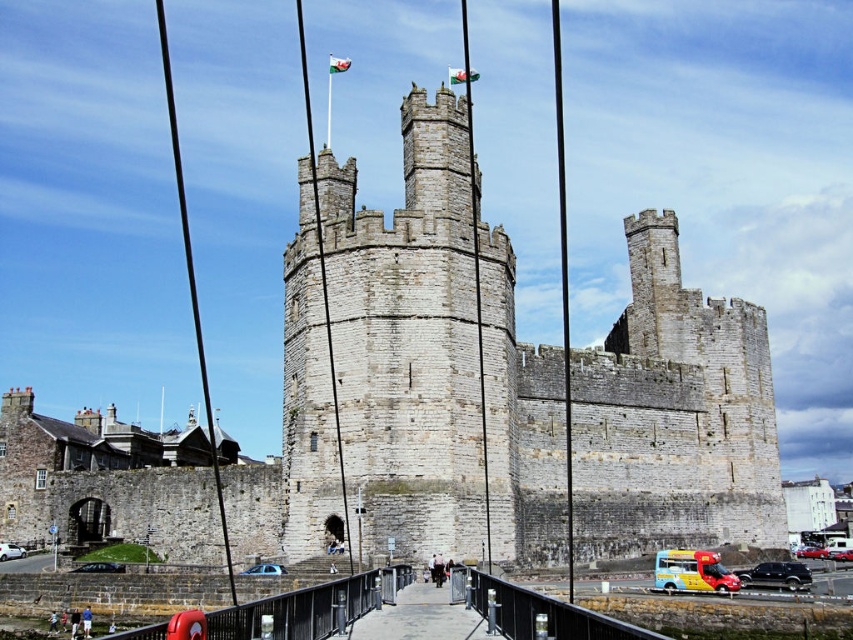
Is the position of gray stone castle at center less distant than that of metallic gray bridge at center?

No, gray stone castle at center is behind metallic gray bridge at center.

Identify the location of gray stone castle at center. (378, 364).

Is point (369, 470) more distant than point (521, 614)?

Yes.

Identify the location of gray stone castle at center. (378, 364).

Can you confirm if metallic gray bridge at center is bigger than concrete walkway at center?

Yes.

How distant is metallic gray bridge at center from concrete walkway at center?

metallic gray bridge at center and concrete walkway at center are 2.46 meters apart from each other.

Between point (483, 612) and point (408, 596), which one is positioned behind?

The point (408, 596) is more distant.

Where is `metallic gray bridge at center`? metallic gray bridge at center is located at coordinates (303, 609).

Does gray stone castle at center appear on the right side of concrete walkway at center?

No, gray stone castle at center is not to the right of concrete walkway at center.

You are a GUI agent. You are given a task and a screenshot of the screen. Output one action in this format:
    pyautogui.click(x=<x>, y=<y>)
    Task: Click on the gray stone castle at center
    This screenshot has width=853, height=640.
    Given the screenshot: What is the action you would take?
    pyautogui.click(x=378, y=364)

The width and height of the screenshot is (853, 640). What are the coordinates of `gray stone castle at center` in the screenshot? It's located at (378, 364).